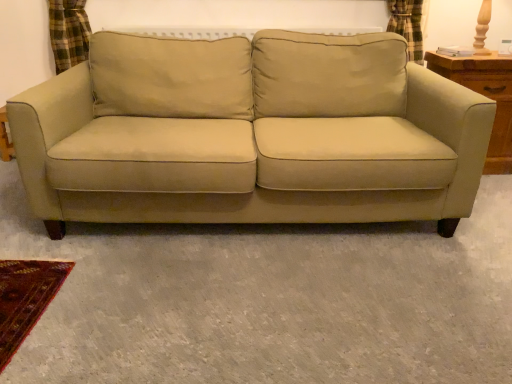
Where is `suede-like beige couch at center`? The height and width of the screenshot is (384, 512). suede-like beige couch at center is located at coordinates (253, 159).

The image size is (512, 384). What do you see at coordinates (253, 159) in the screenshot?
I see `suede-like beige couch at center` at bounding box center [253, 159].

Describe the element at coordinates (486, 96) in the screenshot. I see `wooden dresser at right` at that location.

This screenshot has width=512, height=384. Identify the location of wooden dresser at right. (486, 96).

Measure the distance between point (483, 78) and camera.

They are 2.14 meters apart.

The width and height of the screenshot is (512, 384). Identify the location of suede-like beige couch at center. tap(253, 159).

Is wooden dresser at right to the left of suede-like beige couch at center from the viewer's perspective?

Incorrect, wooden dresser at right is not on the left side of suede-like beige couch at center.

Which is in front, wooden dresser at right or suede-like beige couch at center?

suede-like beige couch at center is in front.

Which is behind, point (490, 144) or point (477, 118)?

The point (490, 144) is behind.

From the image's perspective, is wooden dresser at right located above or below suede-like beige couch at center?

From the image's perspective, wooden dresser at right appears above suede-like beige couch at center.

From a real-world perspective, between wooden dresser at right and suede-like beige couch at center, who is vertically lower?

wooden dresser at right.

Looking at their sizes, would you say wooden dresser at right is wider or thinner than suede-like beige couch at center?

In the image, wooden dresser at right appears to be more narrow than suede-like beige couch at center.

Which of these two, wooden dresser at right or suede-like beige couch at center, stands taller?

Standing taller between the two is suede-like beige couch at center.

Between wooden dresser at right and suede-like beige couch at center, which one has larger size?

suede-like beige couch at center.

Would you say wooden dresser at right contains suede-like beige couch at center?

No, suede-like beige couch at center is not surrounded by wooden dresser at right.

Is wooden dresser at right next to suede-like beige couch at center?

No, wooden dresser at right is not touching suede-like beige couch at center.

Is wooden dresser at right looking in the opposite direction of suede-like beige couch at center?

No, wooden dresser at right is not facing the opposite direction of suede-like beige couch at center.

Find the location of `dresser located underneath the suede-like beige couch at center (from a real-world perspective)`. dresser located underneath the suede-like beige couch at center (from a real-world perspective) is located at coordinates (486, 96).

Which is more to the right, suede-like beige couch at center or wooden dresser at right?

wooden dresser at right is more to the right.

From the picture: Who is more distant, suede-like beige couch at center or wooden dresser at right?

wooden dresser at right is behind.

Considering the points (403, 202) and (503, 71), which point is in front, point (403, 202) or point (503, 71)?

Point (403, 202)

From the image's perspective, would you say suede-like beige couch at center is positioned over wooden dresser at right?

No, from the image's perspective, suede-like beige couch at center is not above wooden dresser at right.

From a real-world perspective, which object stands above the other?

suede-like beige couch at center is physically above.

Which object is wider, suede-like beige couch at center or wooden dresser at right?

With larger width is suede-like beige couch at center.

Considering the sizes of objects suede-like beige couch at center and wooden dresser at right in the image provided, who is shorter, suede-like beige couch at center or wooden dresser at right?

wooden dresser at right.

Can you confirm if suede-like beige couch at center is smaller than wooden dresser at right?

Incorrect, suede-like beige couch at center is not smaller in size than wooden dresser at right.

Is suede-like beige couch at center located outside wooden dresser at right?

Indeed, suede-like beige couch at center is completely outside wooden dresser at right.

Is suede-like beige couch at center not close to wooden dresser at right?

No, suede-like beige couch at center is not far away from wooden dresser at right.

Is suede-like beige couch at center turned away from wooden dresser at right?

No, wooden dresser at right is not at the back of suede-like beige couch at center.

You are a GUI agent. You are given a task and a screenshot of the screen. Output one action in this format:
    pyautogui.click(x=<x>, y=<y>)
    Task: Click on the studio couch above the wooden dresser at right (from a real-world perspective)
    
    Given the screenshot: What is the action you would take?
    pyautogui.click(x=253, y=159)

Where is `dresser above the suede-like beige couch at center (from the image's perspective)`? The image size is (512, 384). dresser above the suede-like beige couch at center (from the image's perspective) is located at coordinates (486, 96).

At what (x,y) coordinates should I click in order to perform the action: click on studio couch that appears in front of the wooden dresser at right. Please return your answer as a coordinate pair (x, y). Looking at the image, I should click on (253, 159).